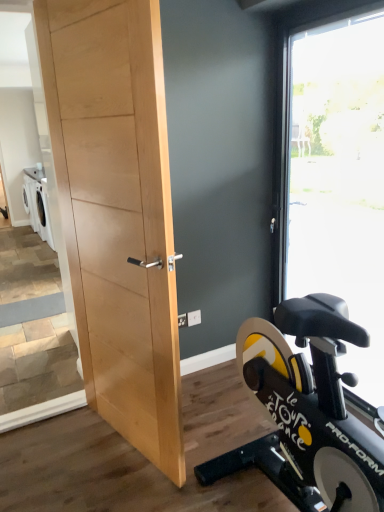
Identify the location of vacant space underneath natural wood door at center (from a real-world perspective). (126, 449).